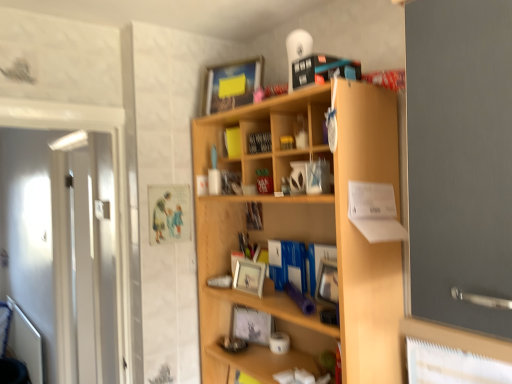
What do you see at coordinates (232, 142) in the screenshot? The image size is (512, 384). I see `yellow matte book at upper center, the third book positioned from the bottom` at bounding box center [232, 142].

Measure the distance between matte silver picture frame at center, which is the second picture frame from top to bottom, and camera.

The depth of matte silver picture frame at center, which is the second picture frame from top to bottom, is 1.60 meters.

Identify the location of matte silver picture frame at center, which appears as the second picture frame when ordered from the bottom. Image resolution: width=512 pixels, height=384 pixels. (249, 277).

Describe the element at coordinates (307, 233) in the screenshot. I see `light wood shelf at center` at that location.

Find the location of a particular element. This screenshot has height=384, width=512. black matte bookshelf at center, acting as the second book starting from the top is located at coordinates (259, 142).

The image size is (512, 384). I want to click on yellow matte book at upper center, marked as the first book in a top-to-bottom arrangement, so click(x=232, y=142).

Which of these two, matte wooden picture frame at upper center, which is counted as the 3th picture frame, starting from the bottom, or light wood shelf at center, stands shorter?

matte wooden picture frame at upper center, which is counted as the 3th picture frame, starting from the bottom.

Looking at this image, which object is more forward, matte wooden picture frame at upper center, which is counted as the 3th picture frame, starting from the bottom, or light wood shelf at center?

light wood shelf at center is in front.

Considering the relative sizes of matte wooden picture frame at upper center, which is counted as the 3th picture frame, starting from the bottom, and light wood shelf at center in the image provided, is matte wooden picture frame at upper center, which is counted as the 3th picture frame, starting from the bottom, wider than light wood shelf at center?

In fact, matte wooden picture frame at upper center, which is counted as the 3th picture frame, starting from the bottom, might be narrower than light wood shelf at center.

Is matte silver picture frame at center, placed as the first picture frame when sorted from bottom to top, not inside matte wooden picture frame at upper center, the first picture frame positioned from the top?

Yes, matte silver picture frame at center, placed as the first picture frame when sorted from bottom to top, is outside of matte wooden picture frame at upper center, the first picture frame positioned from the top.

Between matte silver picture frame at center, the 3th picture frame when ordered from top to bottom, and matte wooden picture frame at upper center, the first picture frame positioned from the top, which one has more height?

Standing taller between the two is matte wooden picture frame at upper center, the first picture frame positioned from the top.

Based on the photo, considering the relative sizes of matte silver picture frame at center, placed as the first picture frame when sorted from bottom to top, and matte wooden picture frame at upper center, the first picture frame positioned from the top, in the image provided, is matte silver picture frame at center, placed as the first picture frame when sorted from bottom to top, thinner than matte wooden picture frame at upper center, the first picture frame positioned from the top,?

Indeed, matte silver picture frame at center, placed as the first picture frame when sorted from bottom to top, has a lesser width compared to matte wooden picture frame at upper center, the first picture frame positioned from the top.

Does matte silver picture frame at center, placed as the first picture frame when sorted from bottom to top, come in front of matte wooden picture frame at upper center, the first picture frame positioned from the top?

No, it is behind matte wooden picture frame at upper center, the first picture frame positioned from the top.

How distant is black matte bookshelf at center, arranged as the first book when viewed from the front, from white glossy door at left?

A distance of 6.04 feet exists between black matte bookshelf at center, arranged as the first book when viewed from the front, and white glossy door at left.

Visually, is black matte bookshelf at center, acting as the second book starting from the top, positioned to the left or to the right of white glossy door at left?

black matte bookshelf at center, acting as the second book starting from the top, is positioned on white glossy door at left's right side.

Would you consider black matte bookshelf at center, acting as the second book starting from the top, to be distant from white glossy door at left?

Yes, black matte bookshelf at center, acting as the second book starting from the top, and white glossy door at left are located far from each other.

Considering the relative sizes of black matte bookshelf at center, which is counted as the third book, starting from the back, and white glossy door at left in the image provided, is black matte bookshelf at center, which is counted as the third book, starting from the back, thinner than white glossy door at left?

Yes.

In the scene shown: Can you tell me how much matte wooden picture frame at upper center, the first picture frame positioned from the top, and black matte bookshelf at center, which is counted as the third book, starting from the back, differ in facing direction?

8.3 degrees separate the facing orientations of matte wooden picture frame at upper center, the first picture frame positioned from the top, and black matte bookshelf at center, which is counted as the third book, starting from the back.

Can you confirm if matte wooden picture frame at upper center, the first picture frame positioned from the top, is smaller than black matte bookshelf at center, acting as the second book starting from the top?

Actually, matte wooden picture frame at upper center, the first picture frame positioned from the top, might be larger than black matte bookshelf at center, acting as the second book starting from the top.

From the image's perspective, is matte wooden picture frame at upper center, which is counted as the 3th picture frame, starting from the bottom, beneath black matte bookshelf at center, arranged as the first book when viewed from the front?

Actually, matte wooden picture frame at upper center, which is counted as the 3th picture frame, starting from the bottom, appears above black matte bookshelf at center, arranged as the first book when viewed from the front, in the image.

Locate an element on the screen. The height and width of the screenshot is (384, 512). screen door below the wooden photo frame at center, which is the 1th book in bottom-to-top order (from the image's perspective) is located at coordinates (62, 251).

Is wooden photo frame at center, the 1th book positioned from the back, positioned beyond the bounds of white glossy door at left?

Answer: Yes, wooden photo frame at center, the 1th book positioned from the back, is outside of white glossy door at left.

Based on the photo, from a real-world perspective, which is physically below, wooden photo frame at center, which is the 1th book in bottom-to-top order, or white glossy door at left?

white glossy door at left, from a real-world perspective.

Is wooden photo frame at center, acting as the 3th book starting from the front, in contact with white glossy door at left?

wooden photo frame at center, acting as the 3th book starting from the front, and white glossy door at left are clearly separated.

What's the angular difference between light wood shelf at center and matte wooden picture frame at upper center, the first picture frame positioned from the top,'s facing directions?

22.9 degrees.

Is light wood shelf at center inside the boundaries of matte wooden picture frame at upper center, which is counted as the 3th picture frame, starting from the bottom, or outside?

light wood shelf at center is located beyond the bounds of matte wooden picture frame at upper center, which is counted as the 3th picture frame, starting from the bottom.

Is light wood shelf at center oriented away from matte wooden picture frame at upper center, the first picture frame positioned from the top?

That's not correct — light wood shelf at center is not looking away from matte wooden picture frame at upper center, the first picture frame positioned from the top.

Between black matte bookshelf at center, arranged as the first book when viewed from the front, and matte wooden picture frame at upper center, the first picture frame positioned from the top, which one is positioned behind?

matte wooden picture frame at upper center, the first picture frame positioned from the top, is further from the camera.

Is point (258, 137) closer to viewer compared to point (205, 80)?

Yes.

This screenshot has height=384, width=512. Identify the location of picture frame that is the 3rd object to the left of the black matte bookshelf at center, arranged as the first book when viewed from the front, starting at the anchor. (232, 84).

Is black matte bookshelf at center, placed as the 2th book when sorted from bottom to top, not within matte wooden picture frame at upper center, which is counted as the 3th picture frame, starting from the bottom?

Yes, black matte bookshelf at center, placed as the 2th book when sorted from bottom to top, is outside of matte wooden picture frame at upper center, which is counted as the 3th picture frame, starting from the bottom.

In the image, there is a matte wooden picture frame at upper center, which is counted as the 3th picture frame, starting from the bottom. Where is `shelf below it (from the image's perspective)`? The width and height of the screenshot is (512, 384). shelf below it (from the image's perspective) is located at coordinates (307, 233).

There is a matte wooden picture frame at upper center, the first picture frame positioned from the top. Find the location of `the 2nd picture frame below it (from a real-world perspective)`. the 2nd picture frame below it (from a real-world perspective) is located at coordinates (251, 325).

Looking at the image, which one is located further to matte silver picture frame at center, which appears as the second picture frame when ordered from the bottom, light wood shelf at center or matte silver picture frame at center, placed as the first picture frame when sorted from bottom to top?

light wood shelf at center lies further to matte silver picture frame at center, which appears as the second picture frame when ordered from the bottom, than the other object.

From the image, which object appears to be farther from matte wooden picture frame at upper center, the first picture frame positioned from the top, yellow matte book at upper center, which appears as the 2th book when viewed from the back, or matte silver picture frame at center, placed as the first picture frame when sorted from bottom to top?

matte silver picture frame at center, placed as the first picture frame when sorted from bottom to top.

From the image, which object appears to be nearer to matte wooden picture frame at upper center, the first picture frame positioned from the top, light wood shelf at center or white glossy door at left?

light wood shelf at center is closer to matte wooden picture frame at upper center, the first picture frame positioned from the top.

Based on their spatial positions, is yellow matte book at upper center, which appears as the 2th book when viewed from the back, or matte wooden picture frame at upper center, which is counted as the 3th picture frame, starting from the bottom, further from white glossy door at left?

yellow matte book at upper center, which appears as the 2th book when viewed from the back.

When comparing their distances from wooden photo frame at center, acting as the 3th book starting from the front, does yellow matte book at upper center, marked as the first book in a top-to-bottom arrangement, or white glossy door at left seem closer?

Based on the image, yellow matte book at upper center, marked as the first book in a top-to-bottom arrangement, appears to be nearer to wooden photo frame at center, acting as the 3th book starting from the front.

When comparing their distances from black matte bookshelf at center, which is counted as the third book, starting from the back, does white glossy door at left or matte silver picture frame at center, placed as the first picture frame when sorted from bottom to top, seem closer?

Among the two, matte silver picture frame at center, placed as the first picture frame when sorted from bottom to top, is located nearer to black matte bookshelf at center, which is counted as the third book, starting from the back.

From the image, which object appears to be nearer to yellow matte book at upper center, arranged as the second book when viewed from the front, light wood shelf at center or wooden photo frame at center, acting as the 3th book starting from the top?

Based on the image, wooden photo frame at center, acting as the 3th book starting from the top, appears to be nearer to yellow matte book at upper center, arranged as the second book when viewed from the front.

From the image, which object appears to be farther from matte wooden picture frame at upper center, which is counted as the 3th picture frame, starting from the bottom, yellow matte book at upper center, arranged as the second book when viewed from the front, or wooden photo frame at center, acting as the 3th book starting from the top?

Based on the image, wooden photo frame at center, acting as the 3th book starting from the top, appears to be further to matte wooden picture frame at upper center, which is counted as the 3th picture frame, starting from the bottom.

This screenshot has width=512, height=384. In order to click on shelf between black matte bookshelf at center, acting as the second book starting from the top, and matte silver picture frame at center, which appears as the second picture frame when ordered from the bottom, from top to bottom in this screenshot , I will do `click(307, 233)`.

Identify the location of book between black matte bookshelf at center, arranged as the first book when viewed from the front, and matte silver picture frame at center, which is the second picture frame from top to bottom, from top to bottom. The image size is (512, 384). (254, 216).

Locate an element on the screen. shelf between matte wooden picture frame at upper center, which is counted as the 3th picture frame, starting from the bottom, and matte silver picture frame at center, which is the second picture frame from top to bottom, in the vertical direction is located at coordinates (307, 233).

Identify the location of screen door that lies between matte wooden picture frame at upper center, which is counted as the 3th picture frame, starting from the bottom, and matte silver picture frame at center, the 3th picture frame when ordered from top to bottom, from top to bottom. (62, 251).